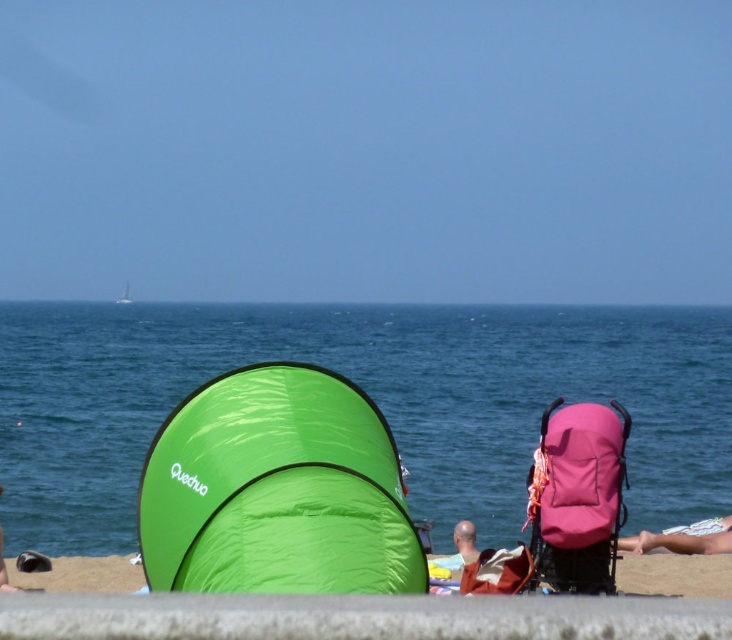
Question: Is green fabric tent at lower center below pink fabric stroller at lower right?

Choices:
 (A) yes
 (B) no

Answer: (B)

Question: Is blue water at center in front of green fabric tent at lower center?

Choices:
 (A) no
 (B) yes

Answer: (A)

Question: Which object is the farthest from the pink fabric towel at lower right?

Choices:
 (A) blue water at center
 (B) green fabric tent at lower center

Answer: (A)

Question: Which object is positioned farthest from the green fabric tent at lower center?

Choices:
 (A) pink fabric towel at lower right
 (B) blue water at center
 (C) green fabric tent at center
 (D) pink fabric stroller at lower right

Answer: (B)

Question: Based on their relative distances, which object is farther from the pink fabric stroller at right?

Choices:
 (A) blue water at center
 (B) pink fabric stroller at lower right

Answer: (A)

Question: Can you confirm if green fabric tent at lower center is thinner than pink fabric stroller at lower right?

Choices:
 (A) no
 (B) yes

Answer: (A)